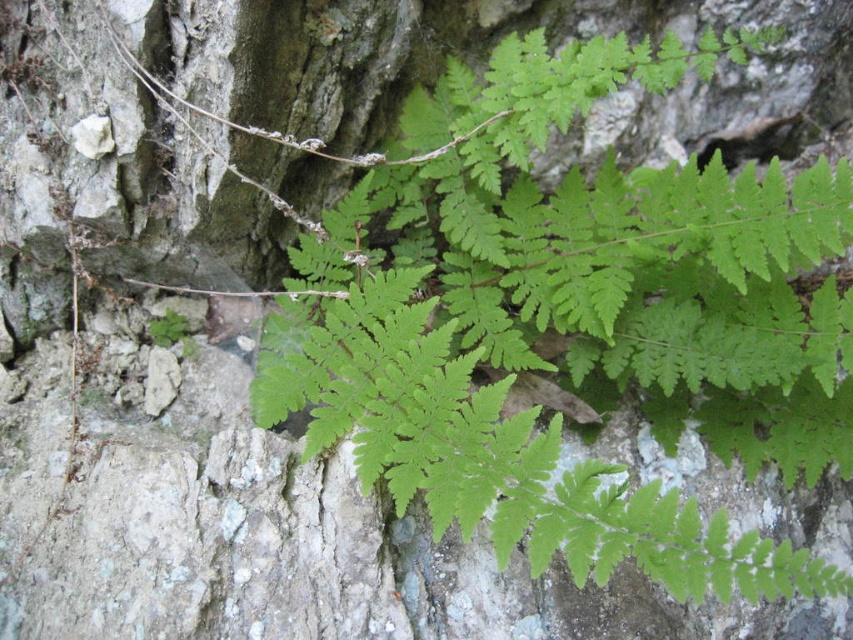
You are a botanist examining two plants in the image. You need to determine which one has a wider spread. The scene shows a green leafy fern at upper right and a green leafy plant at upper left. Based on their positions and the description, which plant has a wider spread?

The green leafy fern at upper right might be wider than green leafy plant at upper left according to the description.

You are a botanist examining two plants in the image. The green leafy fern at upper right and the green leafy plant at upper left. Which one would you need to lean forward less to examine closely?

The green leafy fern at upper right is closer to the viewer, so you would need to lean forward less to examine it closely compared to the green leafy plant at upper left.